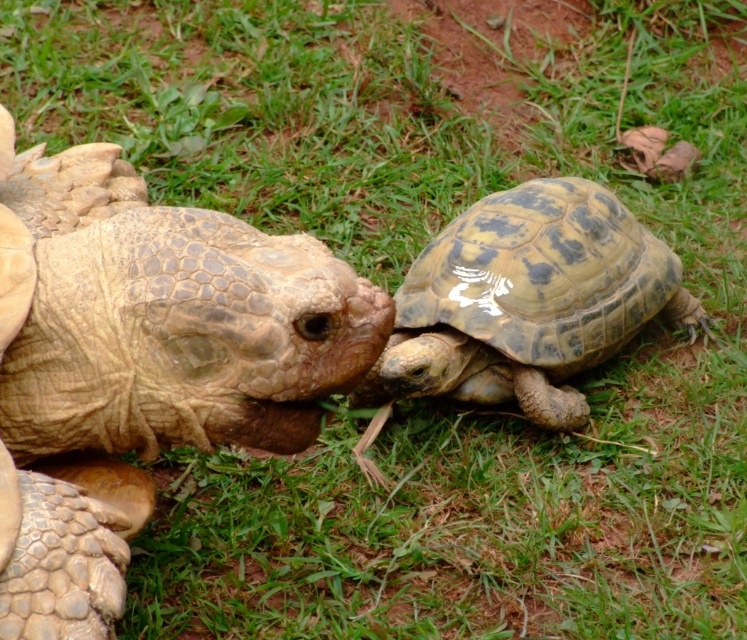
Measure the distance from leathery brown tortoise at center to shiny greenish-brown tortoise at right.

The distance of leathery brown tortoise at center from shiny greenish-brown tortoise at right is 36.19 inches.

Consider the image. Does leathery brown tortoise at center lie behind shiny greenish-brown tortoise at right?

That is False.

Which is behind, point (66, 380) or point (554, 420)?

Point (554, 420)

What are the coordinates of `leathery brown tortoise at center` in the screenshot? It's located at (142, 364).